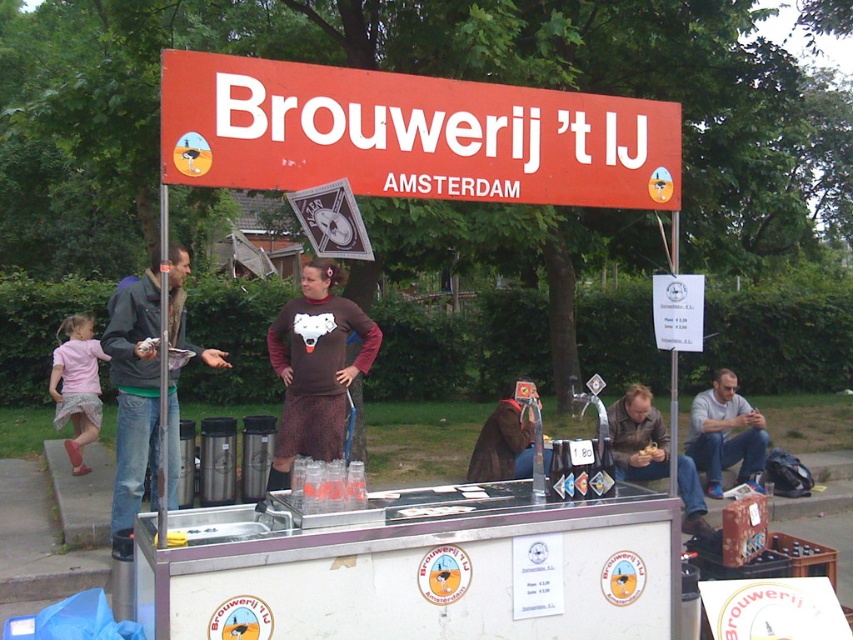
Does brown cotton sweater at center appear on the right side of brown leather jacket at lower right?

In fact, brown cotton sweater at center is to the left of brown leather jacket at lower right.

Based on the photo, is brown cotton sweater at center to the left of brown leather jacket at lower right from the viewer's perspective?

Indeed, brown cotton sweater at center is positioned on the left side of brown leather jacket at lower right.

What are the coordinates of `brown cotton sweater at center` in the screenshot? It's located at (315, 369).

Which is below, jeans jacket at left or gray fabric shirt at lower right?

gray fabric shirt at lower right is lower down.

Which is behind, point (155, 344) or point (717, 400)?

Positioned behind is point (717, 400).

Locate an element on the screen. The height and width of the screenshot is (640, 853). jeans jacket at left is located at coordinates (134, 390).

Is red plastic sign at upper center wider than brown cotton sweater at center?

Indeed, red plastic sign at upper center has a greater width compared to brown cotton sweater at center.

Between red plastic sign at upper center and brown cotton sweater at center, which one is positioned higher?

red plastic sign at upper center is higher up.

Who is more forward, (256, 186) or (291, 340)?

Positioned in front is point (256, 186).

Locate an element on the screen. The image size is (853, 640). red plastic sign at upper center is located at coordinates (410, 134).